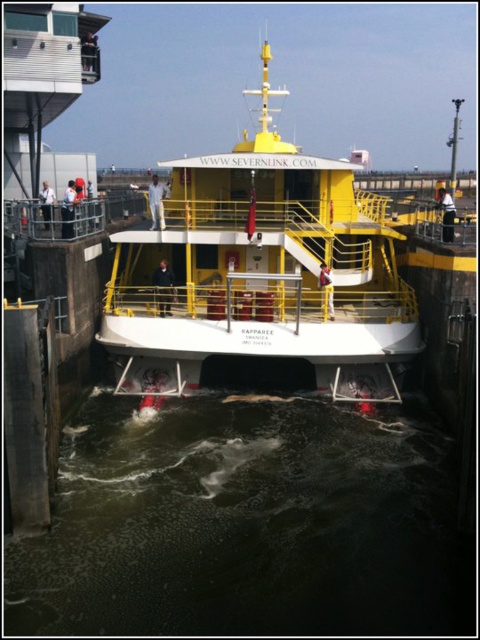
Who is positioned more to the right, dark murky water at lower center or yellow matte boat at center?

yellow matte boat at center

Between dark murky water at lower center and yellow matte boat at center, which one has more height?

yellow matte boat at center is taller.

Between point (380, 596) and point (392, 353), which one is positioned in front?

Positioned in front is point (380, 596).

Locate an element on the screen. This screenshot has width=480, height=640. dark murky water at lower center is located at coordinates (244, 525).